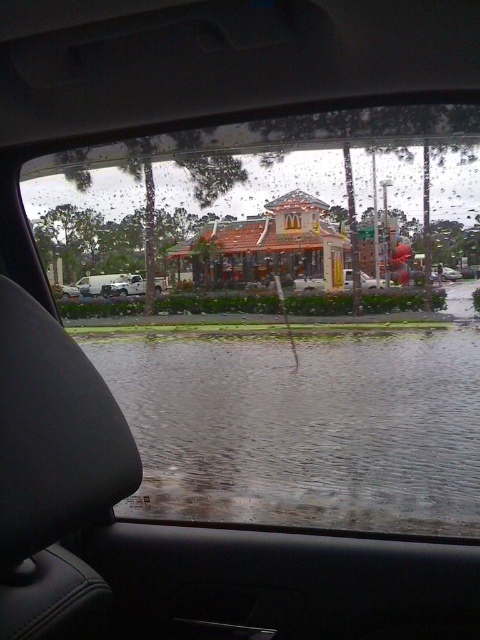
You are driving a car and notice the transparent glass car window at center and the clear water at lower center. Which object is higher in the image?

The transparent glass car window at center is above the clear water at lower center, so it is higher in the image.

You are driving a car and see the flooded street outside the McDonalds. The point where you need to stop is at coordinate point (268, 305). If your car can safely pass through water up to 10 meters deep, can you drive through the flooded area to reach that point?

The point at (268, 305) is 11.34 meters away from the viewer. Since the car can only safely pass through water up to 10 meters deep, it cannot safely drive through the flooded area to reach that point.